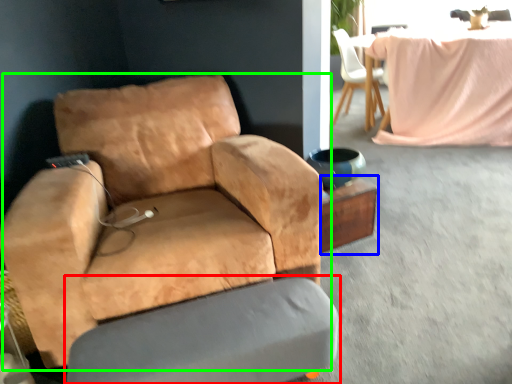
Question: Which is farther away from swivel chair (highlighted by a red box)? side table (highlighted by a blue box) or chair (highlighted by a green box)?

Choices:
 (A) side table
 (B) chair

Answer: (A)